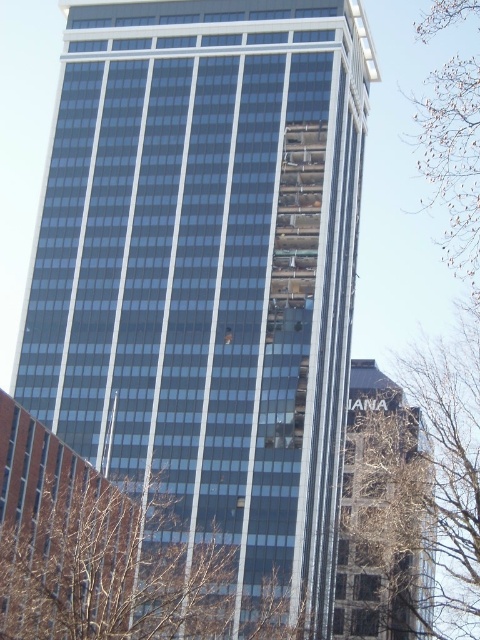
Is brown leafy tree at right above brown leafless branches at lower center?

Incorrect, brown leafy tree at right is not positioned above brown leafless branches at lower center.

The image size is (480, 640). I want to click on brown leafy tree at right, so click(412, 497).

Looking at this image, is brown leafy tree at right to the left of brown leafy tree at upper right from the viewer's perspective?

Correct, you'll find brown leafy tree at right to the left of brown leafy tree at upper right.

Can you confirm if brown leafy tree at right is shorter than brown leafy tree at upper right?

Correct, brown leafy tree at right is not as tall as brown leafy tree at upper right.

I want to click on brown leafy tree at right, so click(412, 497).

Is brown leafless branches at lower center below brown leafy tree at upper right?

Correct, brown leafless branches at lower center is located below brown leafy tree at upper right.

Locate an element on the screen. The width and height of the screenshot is (480, 640). brown leafless branches at lower center is located at coordinates (108, 570).

Locate an element on the screen. The image size is (480, 640). brown leafless branches at lower center is located at coordinates (108, 570).